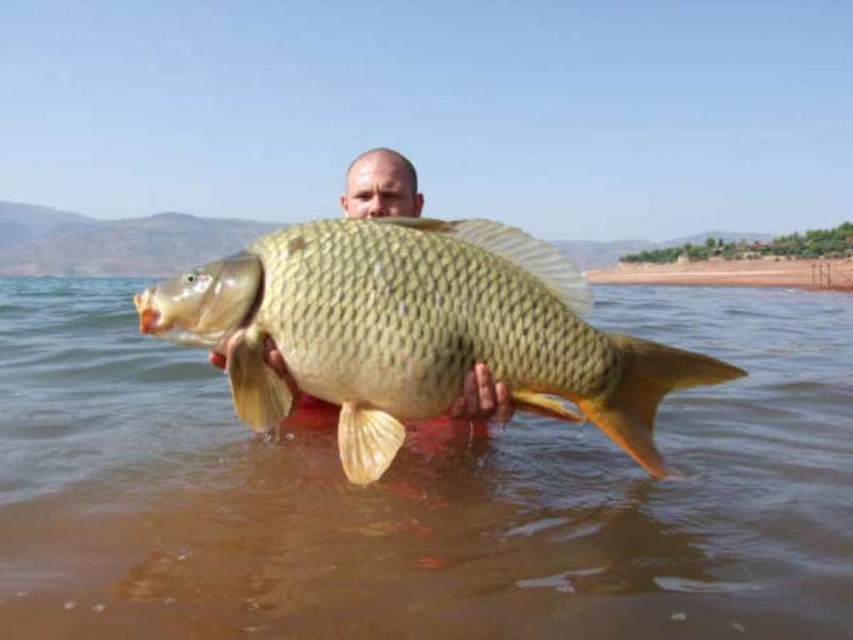
Question: Is brown matte water at center positioned at the back of shiny gold fish at center?

Choices:
 (A) no
 (B) yes

Answer: (B)

Question: Among these objects, which one is nearest to the camera?

Choices:
 (A) brown matte water at center
 (B) shiny gold fish at center

Answer: (B)

Question: Is brown matte water at center above shiny gold fish at center?

Choices:
 (A) no
 (B) yes

Answer: (B)

Question: Which point is farther to the camera?

Choices:
 (A) brown matte water at center
 (B) shiny gold fish at center

Answer: (A)

Question: Does brown matte water at center lie behind shiny gold fish at center?

Choices:
 (A) yes
 (B) no

Answer: (A)